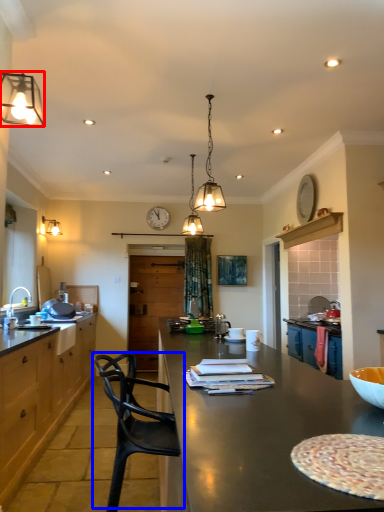
Question: Which object appears farthest to the camera in this image, lamp (highlighted by a red box) or chair (highlighted by a blue box)?

Choices:
 (A) lamp
 (B) chair

Answer: (A)